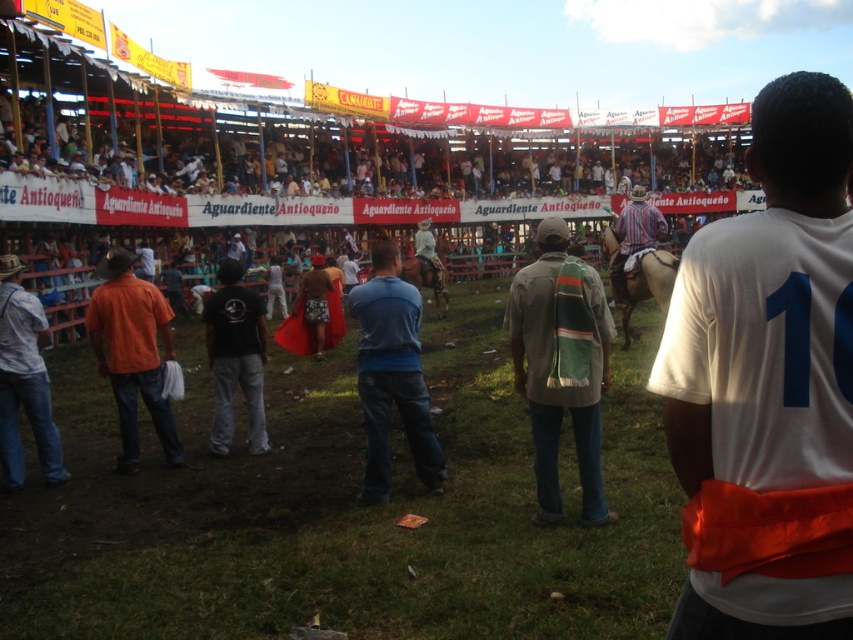
You are a photographer trying to capture a candid shot of the person wearing the orange cotton shirt at left and the denim jeans at lower left. Since you want to focus on the shirt, should you adjust your camera to zoom in or out compared to framing the jeans?

The orange cotton shirt at left occupies less space than denim jeans at lower left. To focus on the shirt, you should zoom in to make the orange cotton shirt at left appear larger in the frame compared to the denim jeans at lower left.

You are a photographer trying to capture a wide shot of the rodeo scene. You notice the white jersey at center and the denim jeans at lower left in your frame. Which object should you zoom in on to ensure both remain in the frame without cropping either?

You should zoom in on the white jersey at center because it occupies less space than the denim jeans at lower left, allowing both to fit within the frame without cropping.